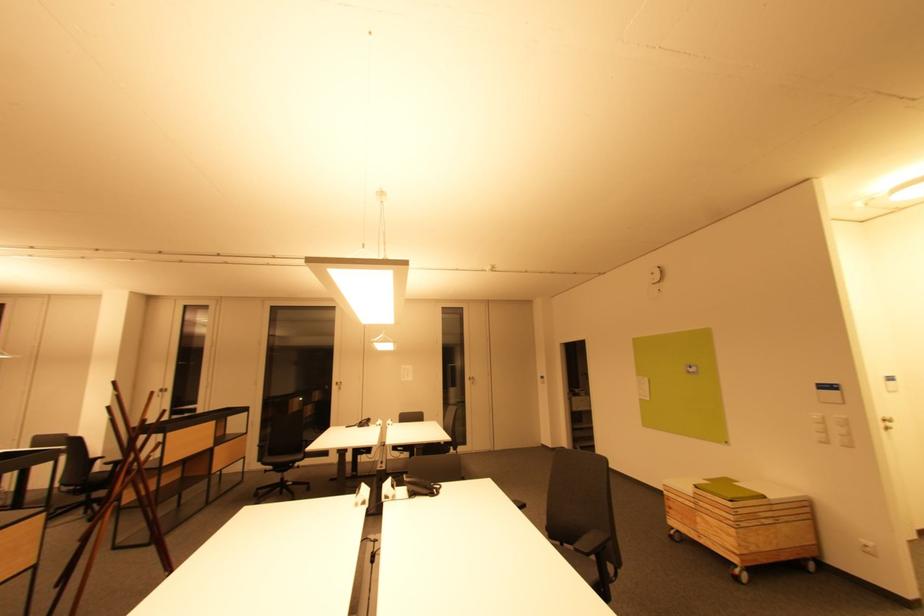
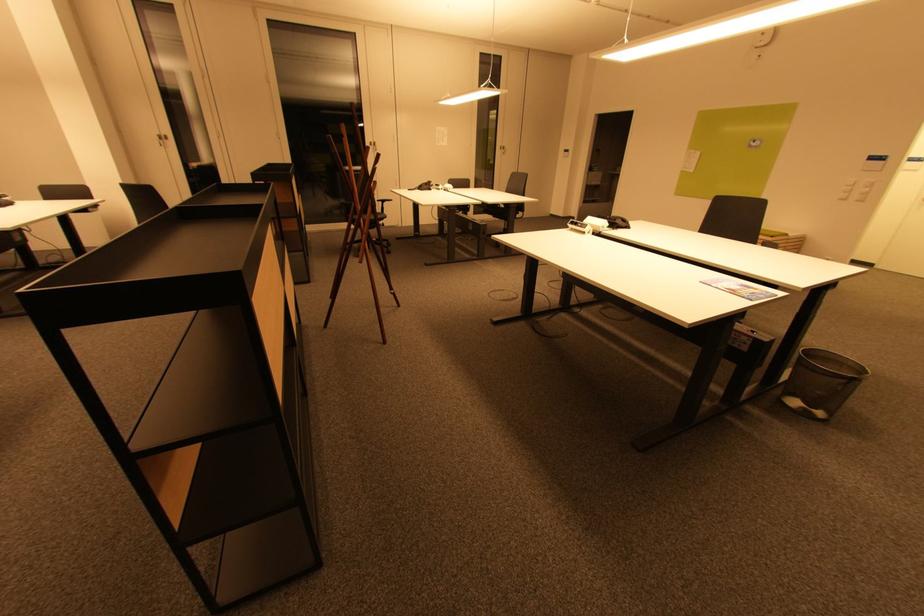
Locate, in the second image, the point that corresponds to point 407,368 in the first image.

(442, 130)